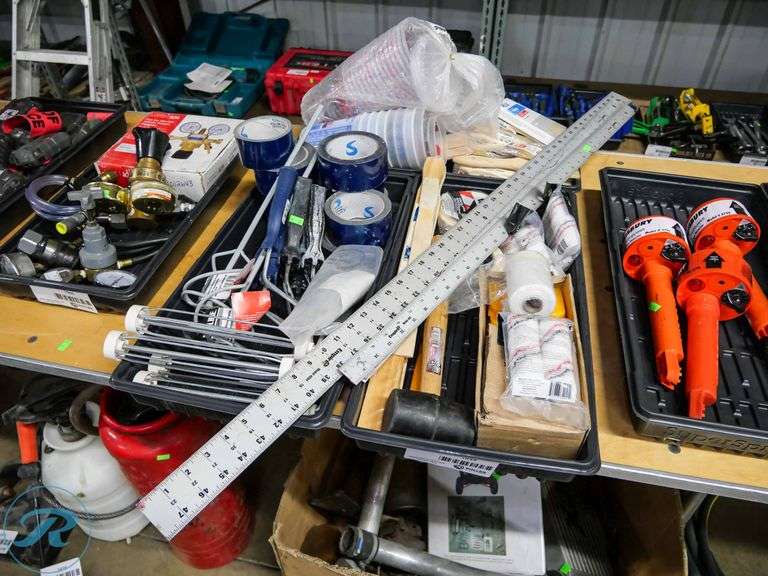
This screenshot has width=768, height=576. Identify the location of paint roller. (160, 348), (193, 324), (223, 382).